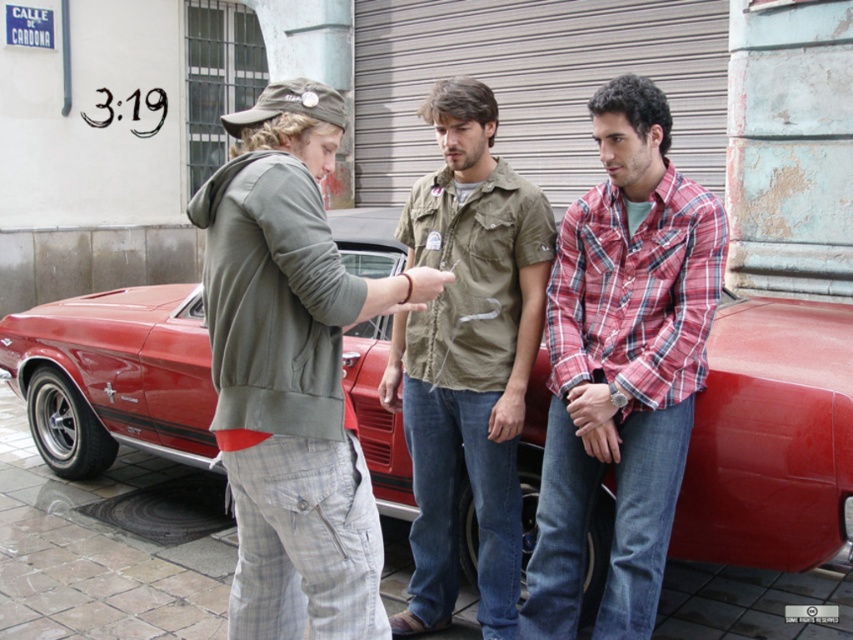
Where is `shiny red car at center`? shiny red car at center is located at coordinates (770, 438).

Is shiny red car at center bigger than khaki cotton shirt at center?

Correct, shiny red car at center is larger in size than khaki cotton shirt at center.

Is point (102, 417) farther from viewer compared to point (401, 230)?

Yes, it is behind point (401, 230).

Identify the location of shiny red car at center. 770,438.

Does plaid cotton shirt at right come behind khaki cotton shirt at center?

No, it is not.

Who is more distant from viewer, (689,428) or (492,333)?

The point (492,333) is behind.

Who is more distant from viewer, [679,442] or [424,385]?

The point [424,385] is more distant.

At what (x,y) coordinates should I click in order to perform the action: click on plaid cotton shirt at right. Please return your answer as a coordinate pair (x, y). Looking at the image, I should click on (622, 365).

Is shiny red car at center further to the viewer compared to plaid cotton shirt at right?

Yes, it is behind plaid cotton shirt at right.

Is point (525, 428) farther from viewer compared to point (650, 202)?

Yes, it is behind point (650, 202).

Does point (762, 564) lie behind point (611, 243)?

Yes, it is.

The height and width of the screenshot is (640, 853). In order to click on shiny red car at center in this screenshot , I will do [x=770, y=438].